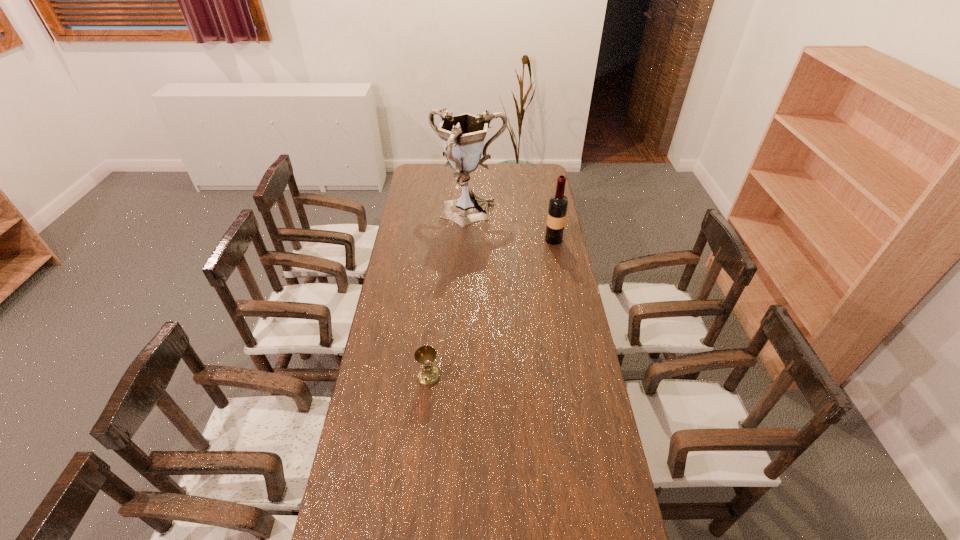
Where is `vacant space at the far edge of the desktop`? The width and height of the screenshot is (960, 540). vacant space at the far edge of the desktop is located at coordinates (450, 183).

At what (x,y) coordinates should I click in order to perform the action: click on vacant space at the left edge. Please return your answer as a coordinate pair (x, y). Looking at the image, I should click on (414, 205).

In the image, there is a desktop. At what (x,y) coordinates should I click in order to perform the action: click on vacant space at the right edge. Please return your answer as a coordinate pair (x, y). The image size is (960, 540). Looking at the image, I should click on (539, 225).

In the image, there is a desktop. Find the location of `free space at the far left corner`. free space at the far left corner is located at coordinates click(x=414, y=175).

I want to click on unoccupied position between the trophy cup and the nearest object, so click(448, 295).

The height and width of the screenshot is (540, 960). What are the coordinates of `vacant space in between the shortest object and the trophy cup` in the screenshot? It's located at (448, 295).

The image size is (960, 540). Identify the location of free space between the second tallest object and the tallest object. (511, 227).

Locate an element on the screen. The image size is (960, 540). vacant area that lies between the shortest object and the tallest object is located at coordinates (448, 295).

The width and height of the screenshot is (960, 540). Find the location of `object that can be found as the closest to the chalice`. object that can be found as the closest to the chalice is located at coordinates (463, 135).

Find the location of `object that is the nearest to the nearest object`. object that is the nearest to the nearest object is located at coordinates (463, 135).